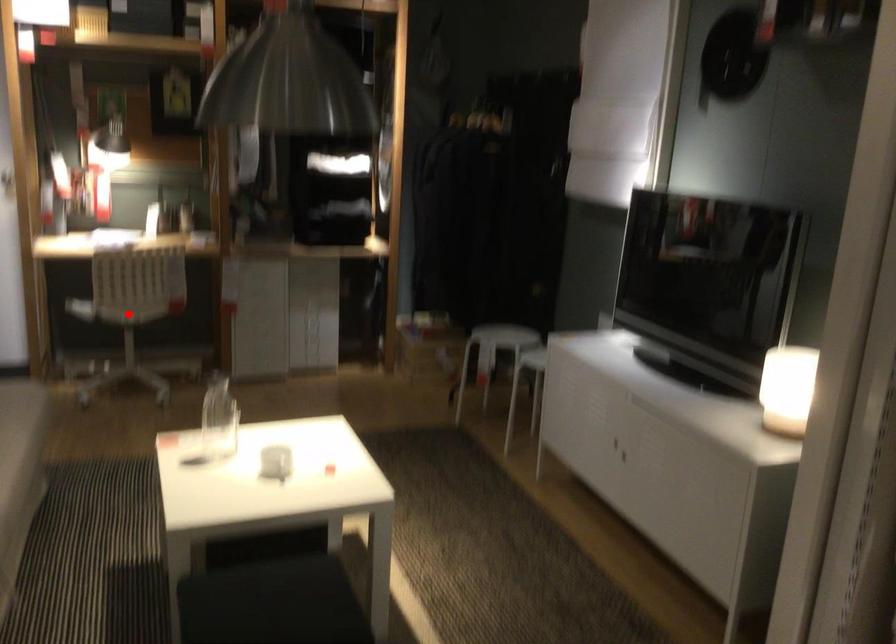
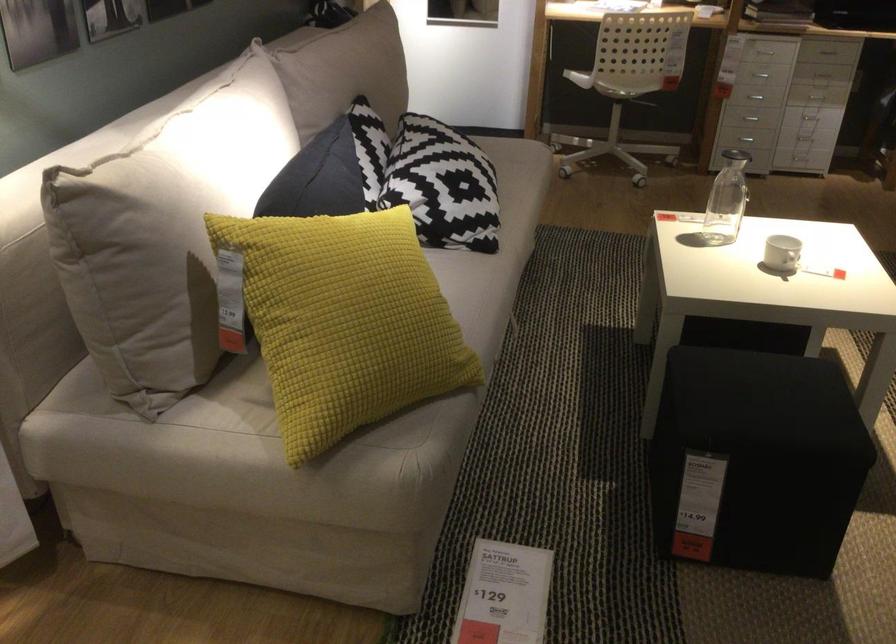
Question: I am providing you with two images of the same scene from different viewpoints. A red point is marked on the first image. Is the red point's position out of view in image 2?

Choices:
 (A) Yes
 (B) No

Answer: (B)